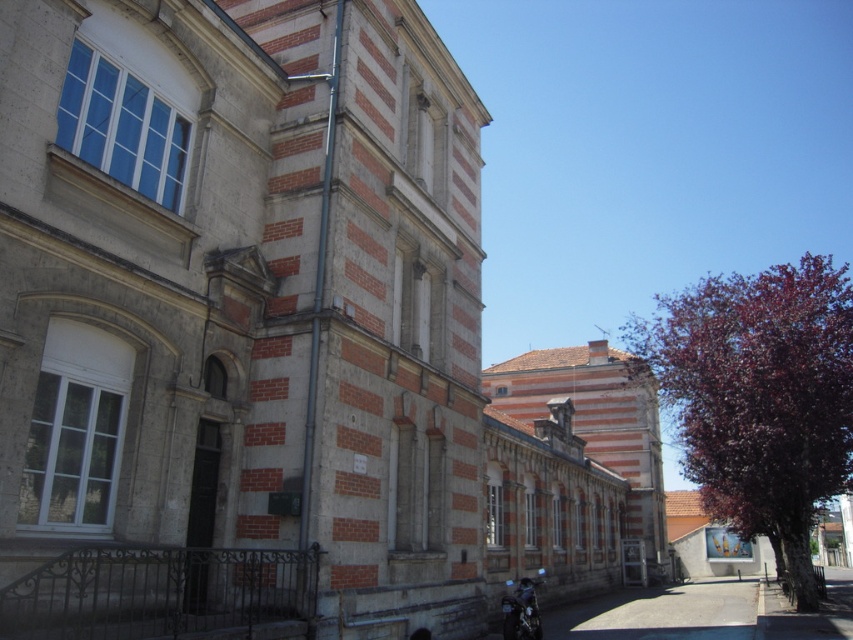
Question: Among these objects, which one is farthest from the camera?

Choices:
 (A) metallic pipe at center
 (B) shiny black motorcycle at lower right

Answer: (B)

Question: Is metallic pipe at center above shiny black motorcycle at lower right?

Choices:
 (A) yes
 (B) no

Answer: (A)

Question: Among these objects, which one is nearest to the camera?

Choices:
 (A) metallic pipe at center
 (B) shiny black motorcycle at lower right

Answer: (A)

Question: Which point is closer to the camera taking this photo?

Choices:
 (A) (526, 608)
 (B) (337, 1)

Answer: (B)

Question: Considering the relative positions of metallic pipe at center and shiny black motorcycle at lower right in the image provided, where is metallic pipe at center located with respect to shiny black motorcycle at lower right?

Choices:
 (A) below
 (B) above

Answer: (B)

Question: Can you confirm if metallic pipe at center is positioned above shiny black motorcycle at lower right?

Choices:
 (A) no
 (B) yes

Answer: (B)